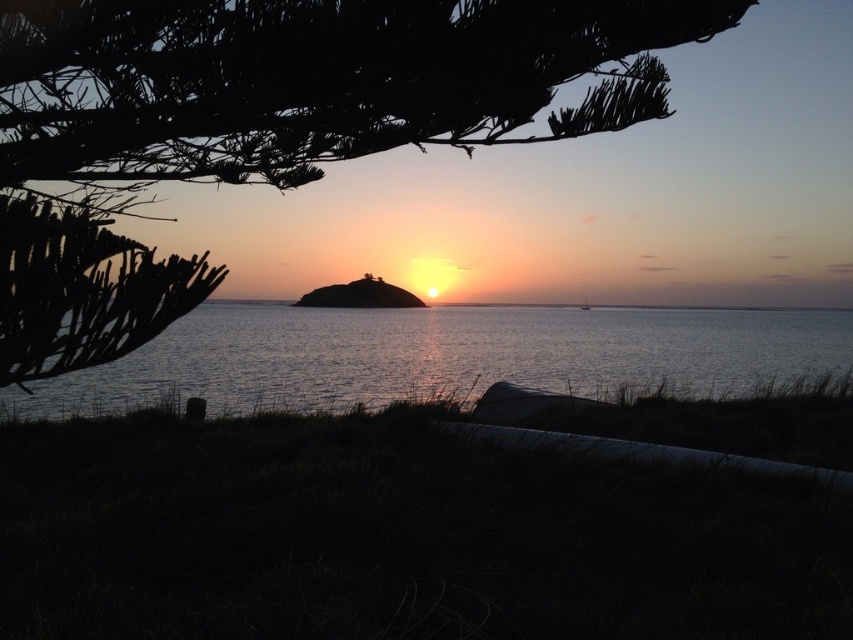
You are standing on the grassy area near the water and want to take a photo of both the green leafy tree at upper left and the white glossy boat at center. Can you fit both in your camera frame if your camera has a maximum field of view of 10 meters wide?

The green leafy tree at upper left and white glossy boat at center are 9.97 meters apart, so yes, both can fit within the camera frame since the distance between them is less than the 10 meters maximum field of view.

You are a photographer standing in the grassy area near the water. You want to capture a photo that includes both the green leafy tree at upper left and the glistening silver water at center. Based on their sizes in the scene, which object would appear larger in your photo?

The green leafy tree at upper left is much taller than the glistening silver water at center, so it would appear larger in the photo.